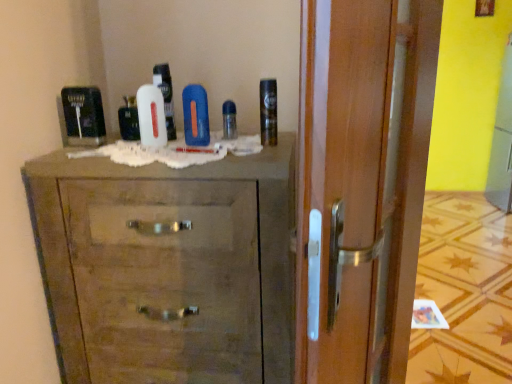
Locate an element on the screen. The height and width of the screenshot is (384, 512). vacant space to the left of blue matte bottle at center is located at coordinates (142, 145).